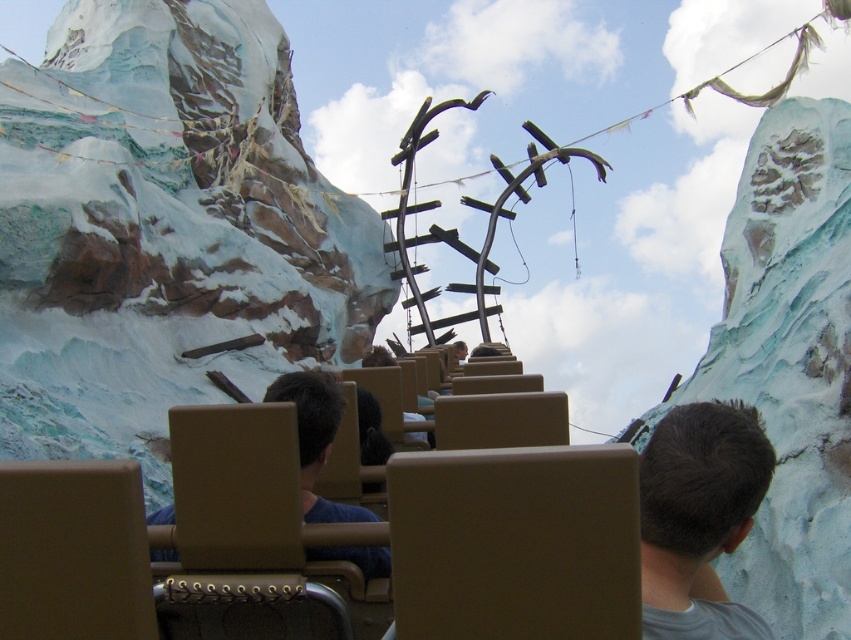
Find the location of a particular element. This screenshot has width=851, height=640. dark brown hair at center is located at coordinates (698, 515).

Can you confirm if dark brown hair at center is shorter than blue fabric shirt at center?

No, dark brown hair at center is not shorter than blue fabric shirt at center.

Identify the location of dark brown hair at center. (698, 515).

Identify the location of dark brown hair at center. (698, 515).

Which is above, dark brown hair at center or brown leather jacket at center?

Positioned higher is brown leather jacket at center.

Does dark brown hair at center lie behind brown leather jacket at center?

No, it is not.

The width and height of the screenshot is (851, 640). What do you see at coordinates (698, 515) in the screenshot?
I see `dark brown hair at center` at bounding box center [698, 515].

Find the location of a particular element. The image size is (851, 640). dark brown hair at center is located at coordinates (698, 515).

Who is higher up, blue fabric shirt at center or brown leather jacket at center?

brown leather jacket at center is above.

Which of these two, blue fabric shirt at center or brown leather jacket at center, stands taller?

Standing taller between the two is blue fabric shirt at center.

Locate an element on the screen. The image size is (851, 640). blue fabric shirt at center is located at coordinates (315, 438).

You are a GUI agent. You are given a task and a screenshot of the screen. Output one action in this format:
    pyautogui.click(x=<x>, y=<y>)
    Task: Click on the blue fabric shirt at center
    This screenshot has height=640, width=851.
    Given the screenshot: What is the action you would take?
    pyautogui.click(x=315, y=438)